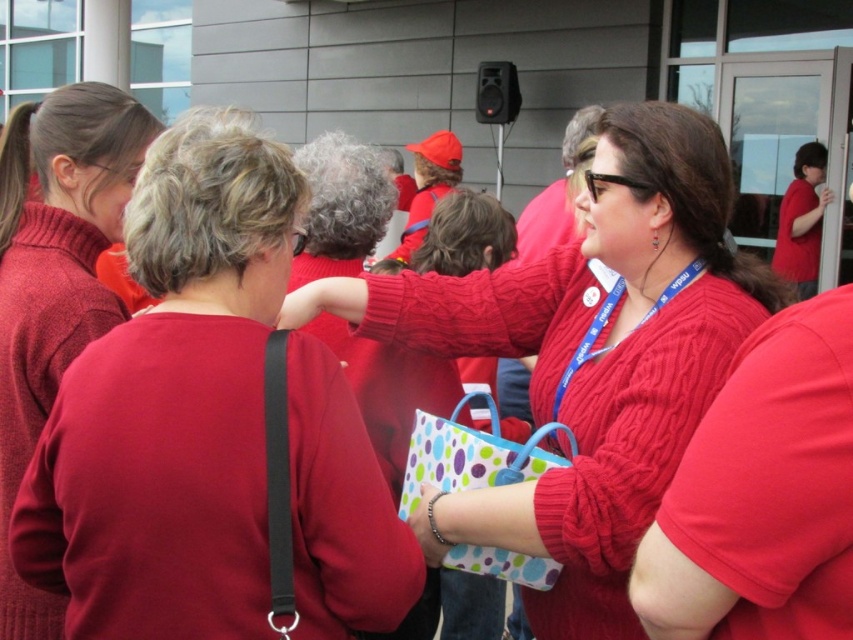
Who is lower down, cable-knit sweater at left or matte red sweater at upper left?

Positioned lower is cable-knit sweater at left.

Can you confirm if cable-knit sweater at left is shorter than matte red sweater at upper left?

Yes, cable-knit sweater at left is shorter than matte red sweater at upper left.

You are a GUI agent. You are given a task and a screenshot of the screen. Output one action in this format:
    pyautogui.click(x=<x>, y=<y>)
    Task: Click on the cable-knit sweater at left
    The width and height of the screenshot is (853, 640).
    Given the screenshot: What is the action you would take?
    pyautogui.click(x=172, y=404)

This screenshot has height=640, width=853. Identify the location of cable-knit sweater at left. (172, 404).

Does cable-knit sweater at left have a lesser width compared to blue fabric lanyard at center?

No, cable-knit sweater at left is not thinner than blue fabric lanyard at center.

Which is more to the left, cable-knit sweater at left or blue fabric lanyard at center?

cable-knit sweater at left is more to the left.

Is point (196, 483) positioned before point (605, 316)?

Yes, point (196, 483) is closer to viewer.

Where is `cable-knit sweater at left`? Image resolution: width=853 pixels, height=640 pixels. cable-knit sweater at left is located at coordinates (172, 404).

Can you confirm if polka dot fabric bag at center is positioned to the left of blue fabric lanyard at center?

Correct, you'll find polka dot fabric bag at center to the left of blue fabric lanyard at center.

Looking at this image, who is positioned more to the right, polka dot fabric bag at center or blue fabric lanyard at center?

blue fabric lanyard at center is more to the right.

Is point (500, 472) behind point (639, 324)?

No, it is in front of (639, 324).

Where is `polka dot fabric bag at center`? polka dot fabric bag at center is located at coordinates (473, 454).